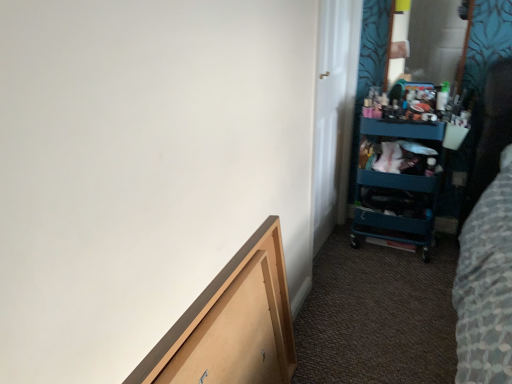
What is the approximate width of white glossy door at upper right?

It is 4.00 inches.

What do you see at coordinates (395, 207) in the screenshot? The height and width of the screenshot is (384, 512). I see `teal plastic cart at right` at bounding box center [395, 207].

Where is `white glossy door at upper right`? white glossy door at upper right is located at coordinates (333, 113).

How much distance is there between wooden drawer at lower left and white glossy door at upper right?

wooden drawer at lower left is 1.15 meters away from white glossy door at upper right.

From a real-world perspective, is wooden drawer at lower left on top of white glossy door at upper right?

No.

Which of these two, wooden drawer at lower left or white glossy door at upper right, is smaller?

Smaller between the two is wooden drawer at lower left.

Consider the image. Can you confirm if wooden drawer at lower left is taller than white glossy door at upper right?

No.

Can you confirm if white glossy door at upper right is smaller than teal plastic cart at right?

Correct, white glossy door at upper right occupies less space than teal plastic cart at right.

From a real-world perspective, between white glossy door at upper right and teal plastic cart at right, who is vertically higher?

white glossy door at upper right.

Considering the positions of objects white glossy door at upper right and teal plastic cart at right in the image provided, who is more to the right, white glossy door at upper right or teal plastic cart at right?

Positioned to the right is teal plastic cart at right.

From the image's perspective, which one is positioned higher, white glossy door at upper right or teal plastic cart at right?

white glossy door at upper right, from the image's perspective.

From the image's perspective, relative to teal plastic cart at right, is wooden drawer at lower left above or below?

From the image's perspective, wooden drawer at lower left appears below teal plastic cart at right.

Is point (219, 300) farther from viewer compared to point (424, 179)?

No, it is not.

You are a GUI agent. You are given a task and a screenshot of the screen. Output one action in this format:
    pyautogui.click(x=<x>, y=<y>)
    Task: Click on the drawer in front of the teal plastic cart at right
    
    Given the screenshot: What is the action you would take?
    pyautogui.click(x=234, y=336)

From the picture: Is wooden drawer at lower left surrounding teal plastic cart at right?

No, teal plastic cart at right is not surrounded by wooden drawer at lower left.

In the scene shown: Is teal plastic cart at right aimed at wooden drawer at lower left?

Yes, teal plastic cart at right is turned towards wooden drawer at lower left.

Is teal plastic cart at right outside of wooden drawer at lower left?

That's correct, teal plastic cart at right is outside of wooden drawer at lower left.

From a real-world perspective, which object rests below the other?

From a 3D spatial view, wooden drawer at lower left is below.

Between point (411, 231) and point (267, 301), which one is positioned in front?

Point (267, 301)

Does white glossy door at upper right have a lesser height compared to wooden drawer at lower left?

No, white glossy door at upper right is not shorter than wooden drawer at lower left.

Locate an element on the screen. This screenshot has width=512, height=384. drawer beneath the white glossy door at upper right (from a real-world perspective) is located at coordinates (234, 336).

Can you confirm if white glossy door at upper right is smaller than wooden drawer at lower left?

No.

Relative to wooden drawer at lower left, is white glossy door at upper right in front or behind?

Clearly, white glossy door at upper right is behind wooden drawer at lower left.

Is teal plastic cart at right spatially inside white glossy door at upper right, or outside of it?

The correct answer is: outside.

Find the location of a particular element. cabinet behind the white glossy door at upper right is located at coordinates (395, 207).

Between teal plastic cart at right and white glossy door at upper right, which one appears on the left side from the viewer's perspective?

From the viewer's perspective, white glossy door at upper right appears more on the left side.

From the image's perspective, who appears lower, teal plastic cart at right or white glossy door at upper right?

teal plastic cart at right, from the image's perspective.

I want to click on drawer on the left of white glossy door at upper right, so click(x=234, y=336).

Locate an element on the screen. The image size is (512, 384). cabinet below the white glossy door at upper right (from the image's perspective) is located at coordinates (395, 207).

Which object lies further to the anchor point white glossy door at upper right, wooden drawer at lower left or teal plastic cart at right?

The object further to white glossy door at upper right is wooden drawer at lower left.

From the image, which object appears to be nearer to wooden drawer at lower left, teal plastic cart at right or white glossy door at upper right?

white glossy door at upper right lies closer to wooden drawer at lower left than the other object.

Looking at the image, which one is located closer to teal plastic cart at right, white glossy door at upper right or wooden drawer at lower left?

white glossy door at upper right lies closer to teal plastic cart at right than the other object.

Which object lies further to the anchor point wooden drawer at lower left, white glossy door at upper right or teal plastic cart at right?

Among the two, teal plastic cart at right is located further to wooden drawer at lower left.

Considering their positions, is wooden drawer at lower left positioned closer to teal plastic cart at right than white glossy door at upper right?

Among the two, white glossy door at upper right is located nearer to teal plastic cart at right.

From the image, which object appears to be nearer to white glossy door at upper right, teal plastic cart at right or wooden drawer at lower left?

The object closer to white glossy door at upper right is teal plastic cart at right.

Image resolution: width=512 pixels, height=384 pixels. I want to click on door between wooden drawer at lower left and teal plastic cart at right along the z-axis, so click(333, 113).